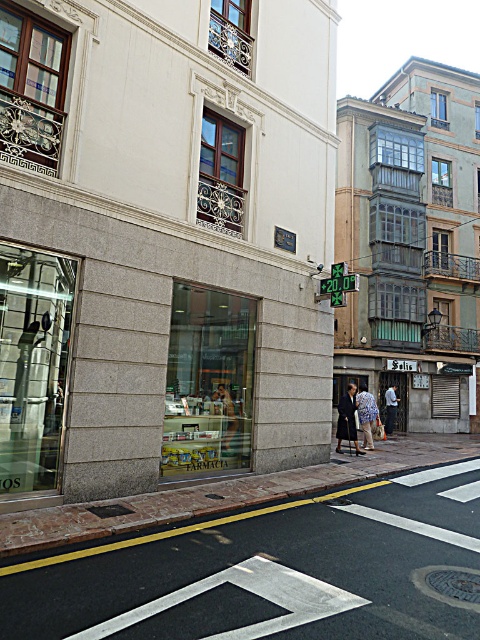
Is granite storefront at center below smooth concrete pavement at center?

No, granite storefront at center is not below smooth concrete pavement at center.

The image size is (480, 640). What are the coordinates of `granite storefront at center` in the screenshot? It's located at (164, 241).

The height and width of the screenshot is (640, 480). What do you see at coordinates (348, 419) in the screenshot?
I see `dark gray coat at center` at bounding box center [348, 419].

This screenshot has height=640, width=480. Find the location of `dark gray coat at center`. dark gray coat at center is located at coordinates (348, 419).

Is granite storefront at center closer to camera compared to blue floral dress at center?

Yes, it is.

Which is behind, point (305, 141) or point (360, 406)?

The point (360, 406) is behind.

Locate an element on the screen. This screenshot has width=480, height=640. granite storefront at center is located at coordinates (164, 241).

Where is `granite storefront at center`? The width and height of the screenshot is (480, 640). granite storefront at center is located at coordinates (164, 241).